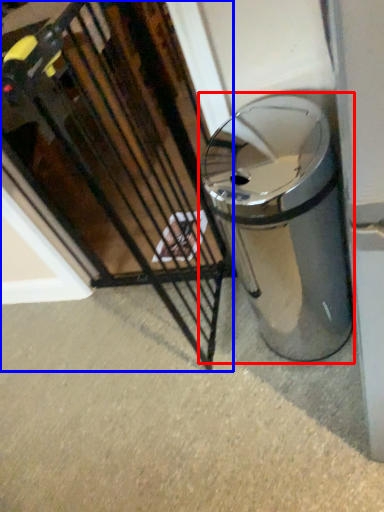
Question: Which of the following is the closest to the observer, waste container (highlighted by a red box) or cage (highlighted by a blue box)?

Choices:
 (A) waste container
 (B) cage

Answer: (B)